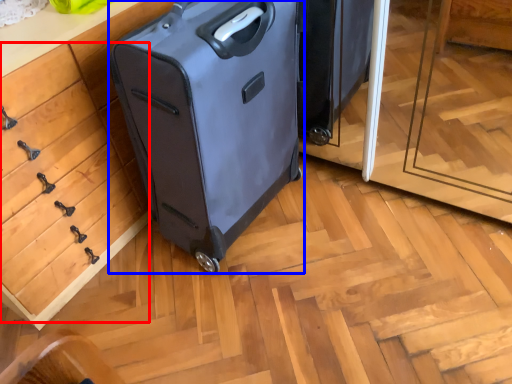
Question: Among these objects, which one is nearest to the camera, drawer (highlighted by a red box) or suitcase (highlighted by a blue box)?

Choices:
 (A) drawer
 (B) suitcase

Answer: (A)